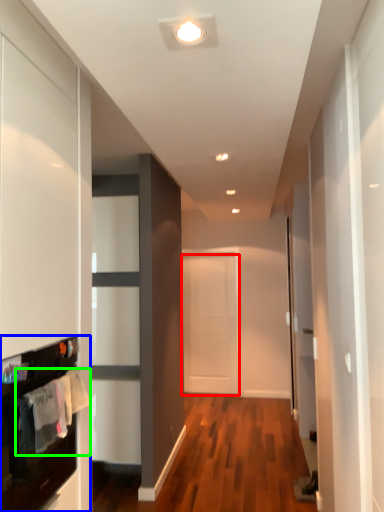
Question: Which object is positioned farthest from door (highlighted by a red box)? Select from cabinetry (highlighted by a blue box) and laundry (highlighted by a green box).

Choices:
 (A) cabinetry
 (B) laundry

Answer: (B)